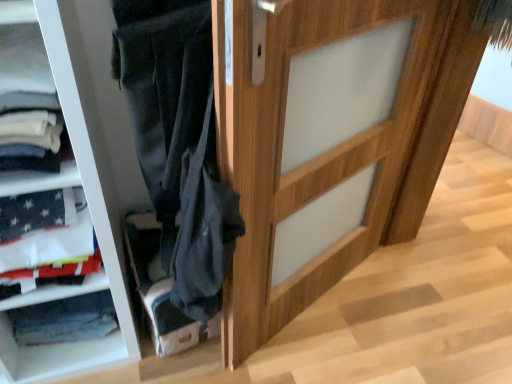
Question: Considering the relative positions of velvet dark blue pants at lower center and wooden door at center in the image provided, is velvet dark blue pants at lower center to the left or to the right of wooden door at center?

Choices:
 (A) right
 (B) left

Answer: (B)

Question: Is velvet dark blue pants at lower center taller or shorter than wooden door at center?

Choices:
 (A) tall
 (B) short

Answer: (B)

Question: Does point (159, 321) appear closer or farther from the camera than point (289, 190)?

Choices:
 (A) farther
 (B) closer

Answer: (A)

Question: Is wooden door at center bigger or smaller than velvet dark blue pants at lower center?

Choices:
 (A) small
 (B) big

Answer: (B)

Question: Based on their positions, is wooden door at center located to the left or right of velvet dark blue pants at lower center?

Choices:
 (A) right
 (B) left

Answer: (A)

Question: Is wooden door at center inside the boundaries of velvet dark blue pants at lower center, or outside?

Choices:
 (A) outside
 (B) inside

Answer: (A)

Question: Relative to velvet dark blue pants at lower center, is wooden door at center in front or behind?

Choices:
 (A) behind
 (B) front

Answer: (B)